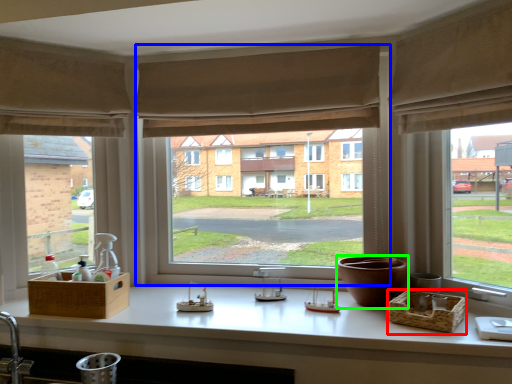
Question: Estimate the real-world distances between objects in this image. Which object is closer to basket (highlighted by a red box), window (highlighted by a blue box) or vase (highlighted by a green box)?

Choices:
 (A) window
 (B) vase

Answer: (B)